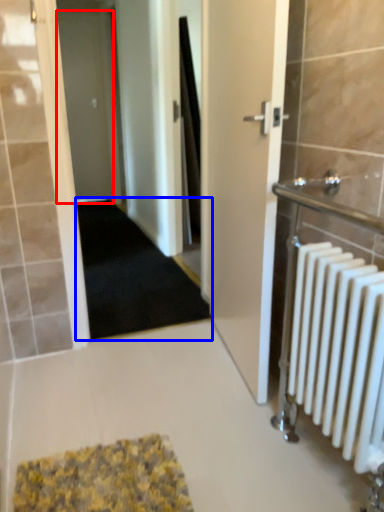
Question: Among these objects, which one is nearest to the camera, door (highlighted by a red box) or doormat (highlighted by a blue box)?

Choices:
 (A) door
 (B) doormat

Answer: (B)